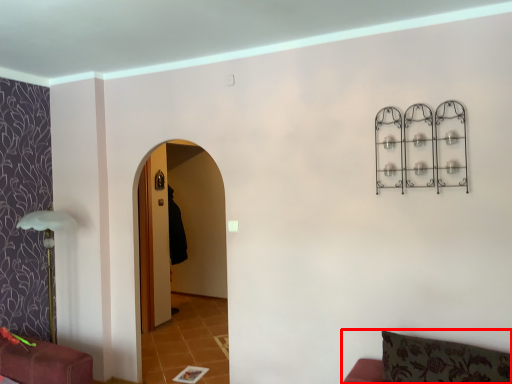
Question: From the image's perspective, where is furniture (annotated by the red box) located in relation to robe in the image?

Choices:
 (A) above
 (B) below

Answer: (B)